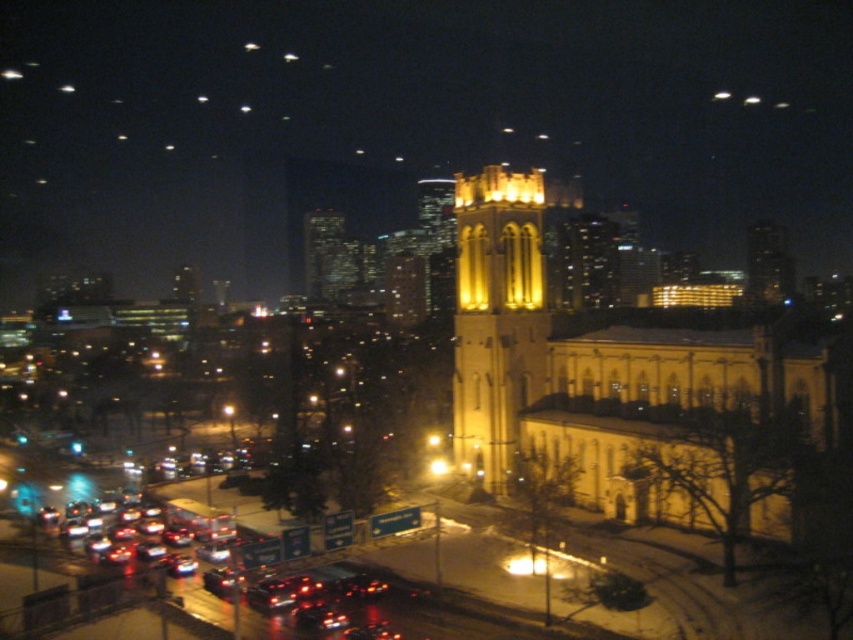
Question: Does yellow stone tower at center appear under shiny black car at lower left?

Choices:
 (A) no
 (B) yes

Answer: (A)

Question: Which point is farther to the camera?

Choices:
 (A) (508, 288)
 (B) (142, 589)
 (C) (708, 346)

Answer: (A)

Question: Which object is closer to the camera taking this photo?

Choices:
 (A) yellow stone tower at center
 (B) shiny black car at lower left
 (C) yellow stone church at center

Answer: (B)

Question: From the image, what is the correct spatial relationship of yellow stone church at center in relation to shiny black car at lower left?

Choices:
 (A) above
 (B) below

Answer: (A)

Question: Among these points, which one is nearest to the camera?

Choices:
 (A) coord(476,410)
 (B) coord(613,506)
 (C) coord(165,592)

Answer: (C)

Question: Is the position of yellow stone church at center less distant than that of yellow stone tower at center?

Choices:
 (A) no
 (B) yes

Answer: (B)